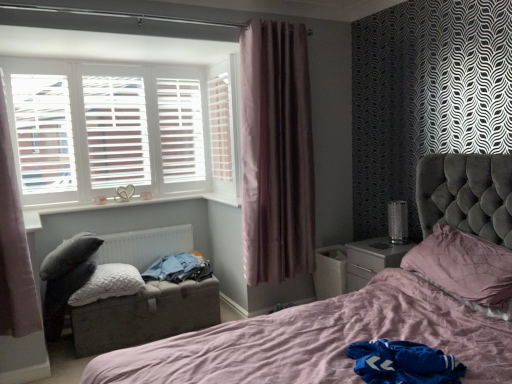
At what (x,y) coordinates should I click in order to perform the action: click on free spot above white glossy window sill at lower left (from a real-world perspective). Please return your answer as a coordinate pair (x, y). Looking at the image, I should click on [120, 203].